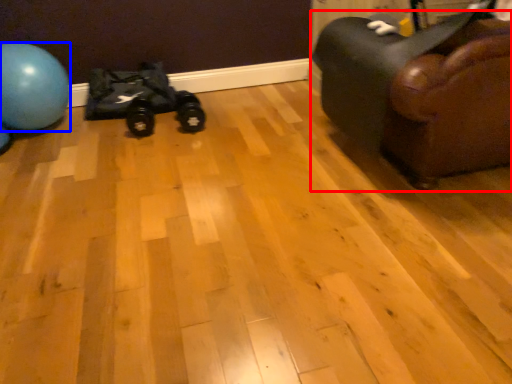
Question: Which point is closer to the camera, furniture (highlighted by a red box) or ball (highlighted by a blue box)?

Choices:
 (A) furniture
 (B) ball

Answer: (A)